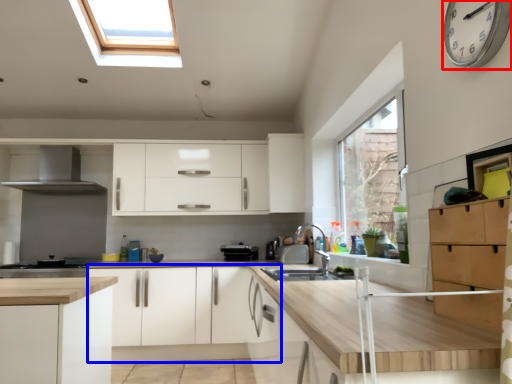
Question: Which object appears closest to the camera in this image, clock (highlighted by a red box) or cabinetry (highlighted by a blue box)?

Choices:
 (A) clock
 (B) cabinetry

Answer: (A)